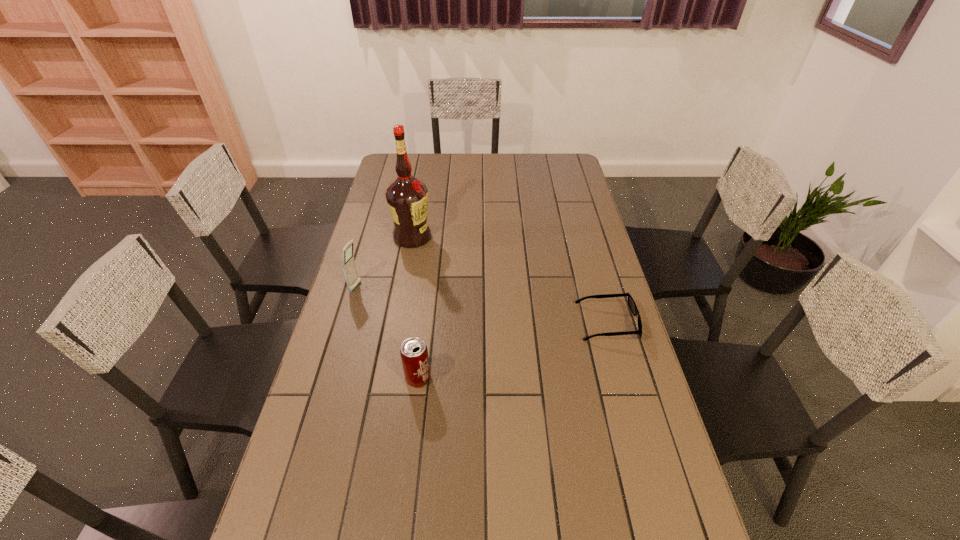
Locate an element on the screen. The height and width of the screenshot is (540, 960). vacant space at the left edge is located at coordinates (320, 365).

This screenshot has height=540, width=960. In the image, there is a desktop. Find the location of `blank space at the right edge`. blank space at the right edge is located at coordinates (633, 442).

In the image, there is a desktop. Find the location of `vacant area at the far left corner`. vacant area at the far left corner is located at coordinates (420, 156).

This screenshot has width=960, height=540. In the image, there is a desktop. What are the coordinates of `vacant space at the far right corner` in the screenshot? It's located at (558, 166).

This screenshot has width=960, height=540. I want to click on empty space that is in between the farthest object and the third nearest object, so click(384, 262).

Locate an element on the screen. The image size is (960, 540). vacant point located between the shortest object and the alcohol is located at coordinates (510, 280).

You are a GUI agent. You are given a task and a screenshot of the screen. Output one action in this format:
    pyautogui.click(x=<x>, y=<y>)
    Task: Click on the vacant space that is in between the third farthest object and the leftmost object
    Image resolution: width=960 pixels, height=540 pixels.
    Given the screenshot: What is the action you would take?
    pyautogui.click(x=482, y=305)

Where is `vacant area that lies between the tallest object and the rightmost object`? vacant area that lies between the tallest object and the rightmost object is located at coordinates (510, 280).

You are a GUI agent. You are given a task and a screenshot of the screen. Output one action in this format:
    pyautogui.click(x=<x>, y=<y>)
    Task: Click on the free space between the alcohol and the beer can
    
    Given the screenshot: What is the action you would take?
    pyautogui.click(x=416, y=308)

Image resolution: width=960 pixels, height=540 pixels. I want to click on free area in between the second shortest object and the second tallest object, so click(387, 333).